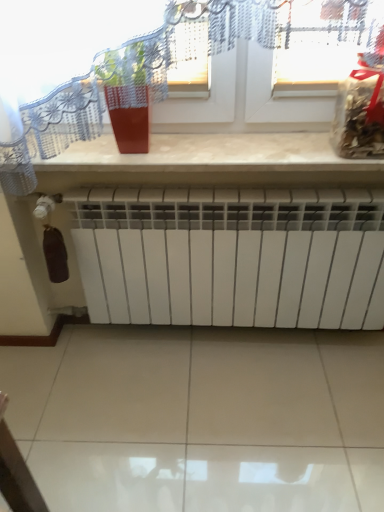
Question: From a real-world perspective, does translucent plastic bag at upper right sit lower than white matte radiator at lower center?

Choices:
 (A) yes
 (B) no

Answer: (B)

Question: Does translucent plastic bag at upper right have a greater height compared to white matte radiator at lower center?

Choices:
 (A) yes
 (B) no

Answer: (B)

Question: Is translucent plastic bag at upper right smaller than white matte radiator at lower center?

Choices:
 (A) yes
 (B) no

Answer: (A)

Question: Is white matte radiator at lower center at the back of translucent plastic bag at upper right?

Choices:
 (A) yes
 (B) no

Answer: (B)

Question: From the image's perspective, is translucent plastic bag at upper right beneath white matte radiator at lower center?

Choices:
 (A) no
 (B) yes

Answer: (A)

Question: In terms of size, does transparent glass window at upper center appear bigger or smaller than beige marble counter at upper center?

Choices:
 (A) big
 (B) small

Answer: (A)

Question: From the image's perspective, is transparent glass window at upper center above or below beige marble counter at upper center?

Choices:
 (A) below
 (B) above

Answer: (B)

Question: From a real-world perspective, relative to beige marble counter at upper center, is transparent glass window at upper center vertically above or below?

Choices:
 (A) below
 (B) above

Answer: (B)

Question: In the image, is transparent glass window at upper center positioned in front of or behind beige marble counter at upper center?

Choices:
 (A) front
 (B) behind

Answer: (A)

Question: In terms of height, does matte red pot at upper center look taller or shorter compared to translucent plastic bag at upper right?

Choices:
 (A) tall
 (B) short

Answer: (B)

Question: Considering their positions, is matte red pot at upper center located in front of or behind translucent plastic bag at upper right?

Choices:
 (A) front
 (B) behind

Answer: (B)

Question: Considering the positions of matte red pot at upper center and translucent plastic bag at upper right in the image, is matte red pot at upper center bigger or smaller than translucent plastic bag at upper right?

Choices:
 (A) big
 (B) small

Answer: (B)

Question: Is point (122, 122) closer or farther from the camera than point (352, 111)?

Choices:
 (A) farther
 (B) closer

Answer: (A)

Question: Based on their sizes in the image, would you say matte red pot at upper center is bigger or smaller than transparent glass window at upper center?

Choices:
 (A) small
 (B) big

Answer: (A)

Question: Considering the relative positions of matte red pot at upper center and transparent glass window at upper center in the image provided, is matte red pot at upper center to the left or to the right of transparent glass window at upper center?

Choices:
 (A) right
 (B) left

Answer: (B)